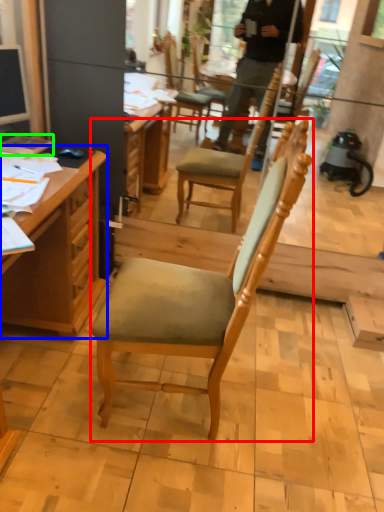
Question: Estimate the real-world distances between objects in this image. Which object is farther from chair (highlighted by a red box), desk (highlighted by a blue box) or book (highlighted by a green box)?

Choices:
 (A) desk
 (B) book

Answer: (B)